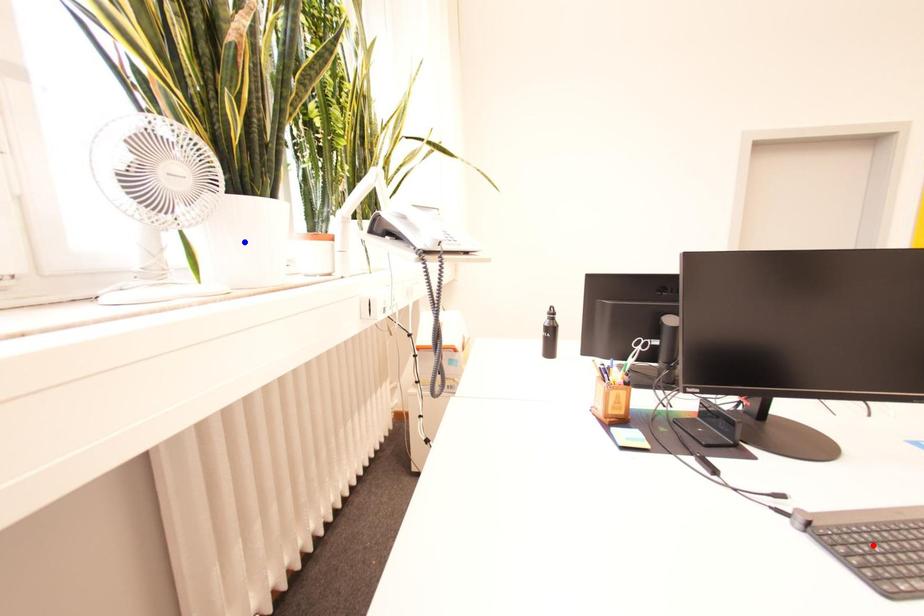
Question: Two points are marked on the image. Which point is closer to the camera?

Choices:
 (A) Blue point is closer.
 (B) Red point is closer.

Answer: (B)